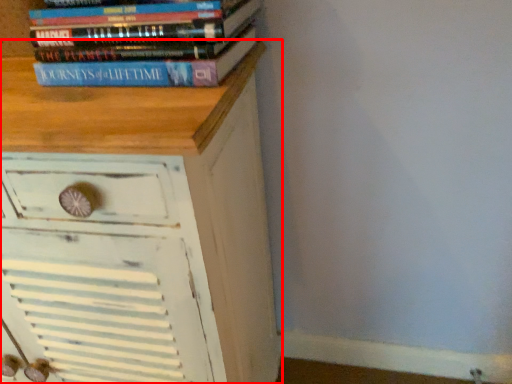
Question: Where is chest of drawers (annotated by the red box) located in relation to book in the image?

Choices:
 (A) left
 (B) right

Answer: (A)